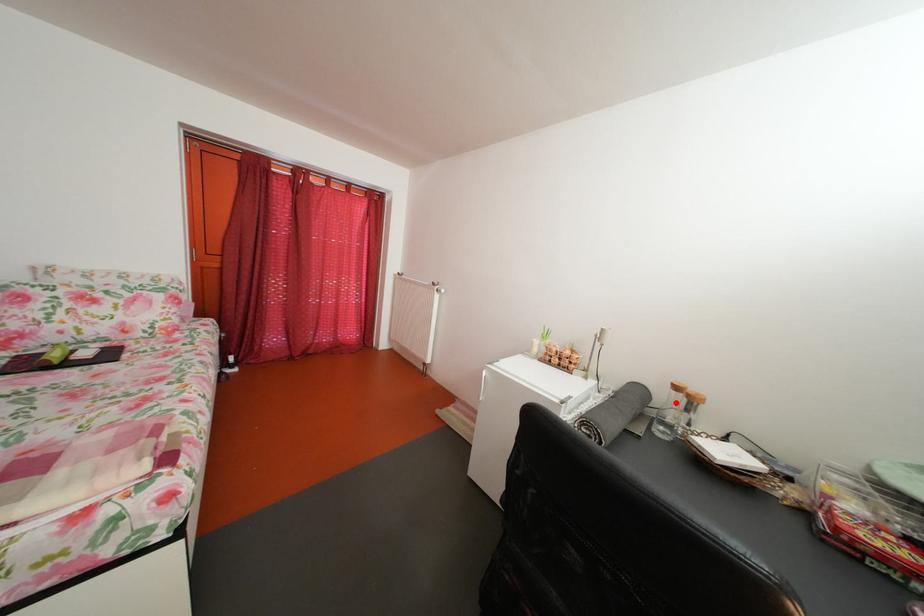
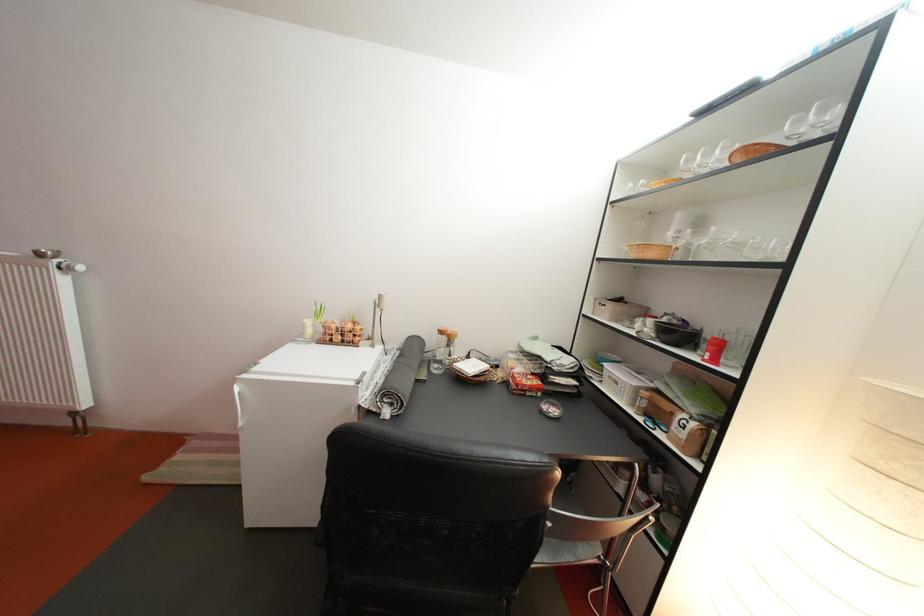
Where in the second image is the point corresponding to the highlighted location from the first image?

(444, 346)